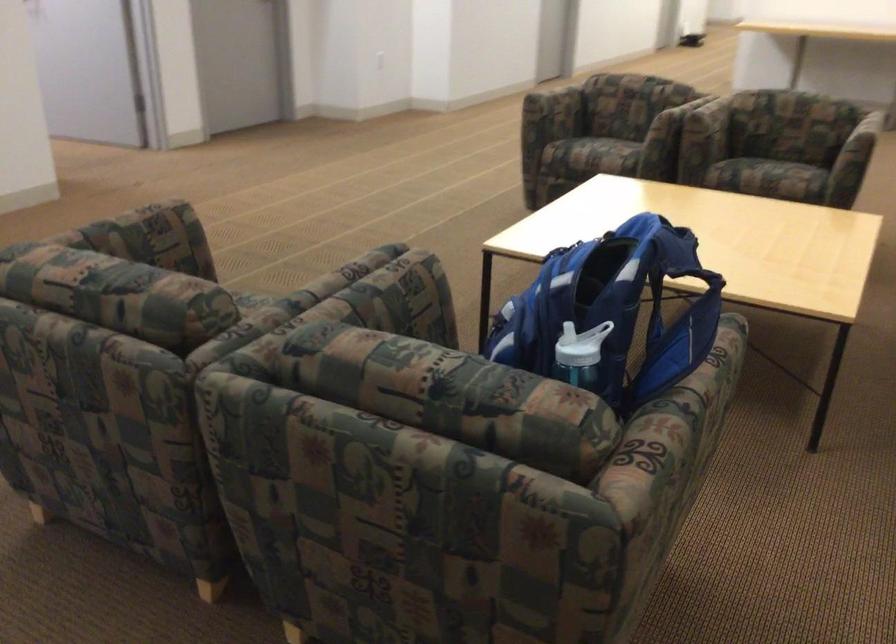
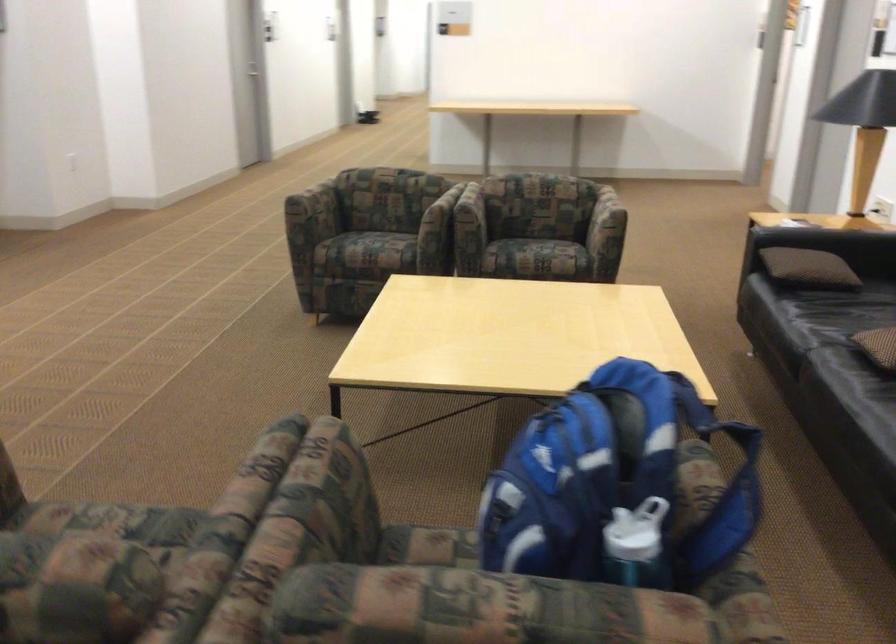
Question: The camera is either moving clockwise (left) or counter-clockwise (right) around the object. The first image is from the beginning of the video and the second image is from the end. Is the camera moving left or right when shooting the video?

Choices:
 (A) Left
 (B) Right

Answer: (A)